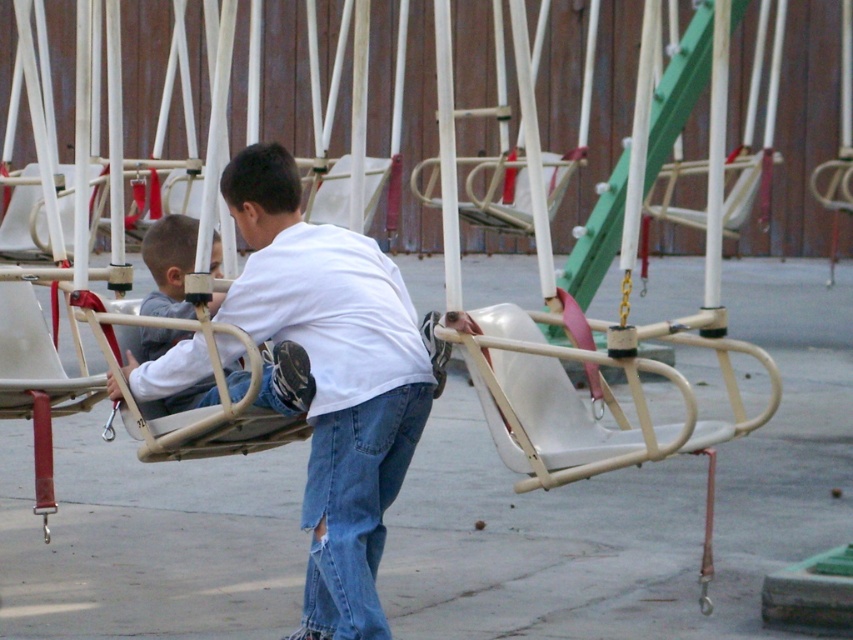
Who is more forward, (332, 563) or (181, 308)?

Point (332, 563) is in front.

From the picture: Who is lower down, denim at center or light gray plastic swing at center?

denim at center is lower down.

This screenshot has width=853, height=640. In order to click on denim at center in this screenshot , I will do `click(355, 506)`.

Who is lower down, white matte shirt at center or denim at center?

denim at center is lower down.

How far apart are white matte shirt at center and denim at center?

They are 5.65 inches apart.

Where is `white matte shirt at center`? The width and height of the screenshot is (853, 640). white matte shirt at center is located at coordinates (334, 378).

Looking at this image, can you confirm if white matte shirt at center is positioned above light gray plastic swing at center?

Actually, white matte shirt at center is below light gray plastic swing at center.

Is point (297, 284) closer to camera compared to point (173, 288)?

Yes.

You are a GUI agent. You are given a task and a screenshot of the screen. Output one action in this format:
    pyautogui.click(x=<x>, y=<y>)
    Task: Click on the white matte shirt at center
    The image size is (853, 640).
    Given the screenshot: What is the action you would take?
    pyautogui.click(x=334, y=378)